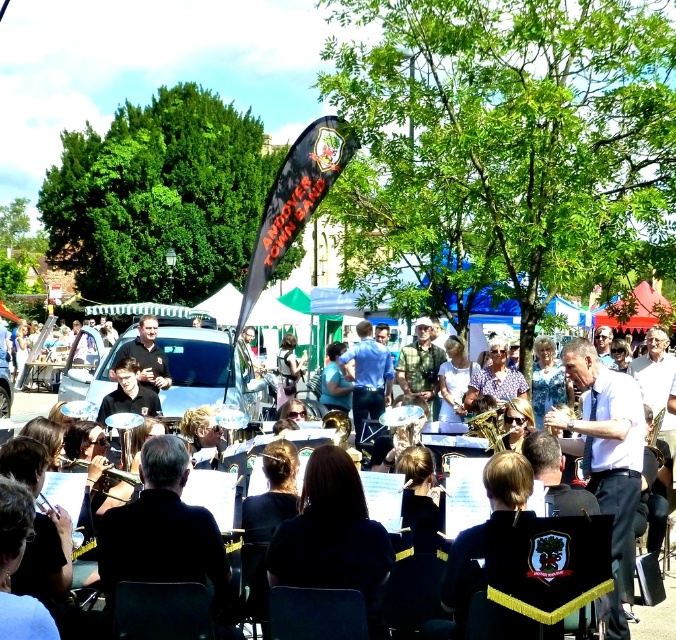
Question: Does white shirt at center have a greater width compared to blue shirt at center?

Choices:
 (A) yes
 (B) no

Answer: (A)

Question: Among these objects, which one is nearest to the camera?

Choices:
 (A) black uniform at center
 (B) blue shirt at center

Answer: (A)

Question: Which of the following is the closest to the observer?

Choices:
 (A) (642, 420)
 (B) (385, 371)

Answer: (A)

Question: Can you confirm if white shirt at center is smaller than black uniform at center?

Choices:
 (A) yes
 (B) no

Answer: (A)

Question: Can you confirm if blue shirt at center is positioned to the left of black uniform at center?

Choices:
 (A) yes
 (B) no

Answer: (B)

Question: Which object is positioned farthest from the black uniform at center?

Choices:
 (A) blue shirt at center
 (B) white shirt at center

Answer: (B)